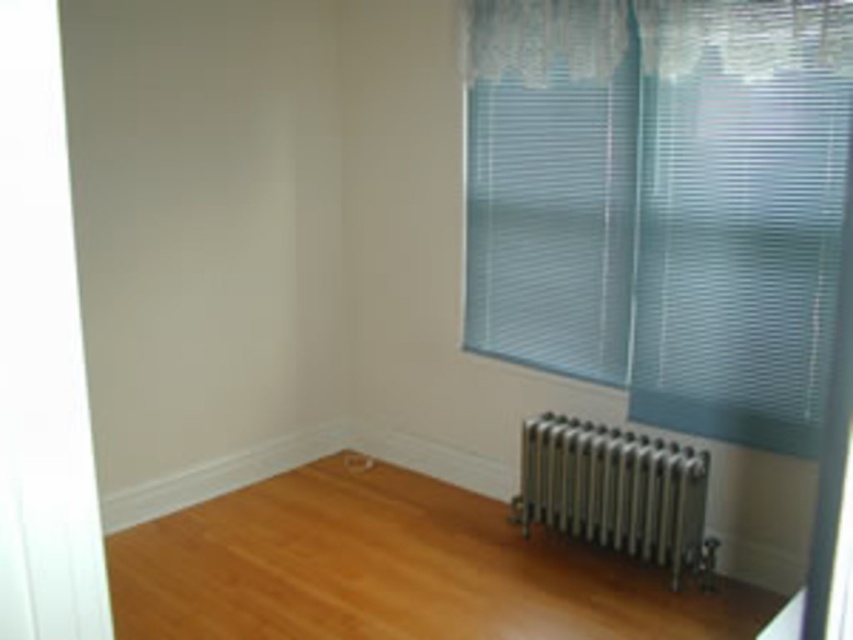
Between translucent plastic blinds at right and silver metallic radiator at lower right, which one is positioned lower?

silver metallic radiator at lower right is below.

Is point (791, 372) in front of point (579, 513)?

Yes, it is in front of point (579, 513).

Identify the location of translucent plastic blinds at right. This screenshot has height=640, width=853. (663, 202).

How much distance is there between translucent plastic blinds at right and shiny brown hardwood floor at center?

translucent plastic blinds at right is 1.07 meters from shiny brown hardwood floor at center.

This screenshot has height=640, width=853. Describe the element at coordinates (663, 202) in the screenshot. I see `translucent plastic blinds at right` at that location.

This screenshot has height=640, width=853. Find the location of `translucent plastic blinds at right`. translucent plastic blinds at right is located at coordinates (663, 202).

This screenshot has width=853, height=640. Describe the element at coordinates (393, 570) in the screenshot. I see `shiny brown hardwood floor at center` at that location.

Between point (590, 602) and point (778, 42), which one is positioned in front?

Point (778, 42) is more forward.

Find the location of a particular element. shiny brown hardwood floor at center is located at coordinates (393, 570).